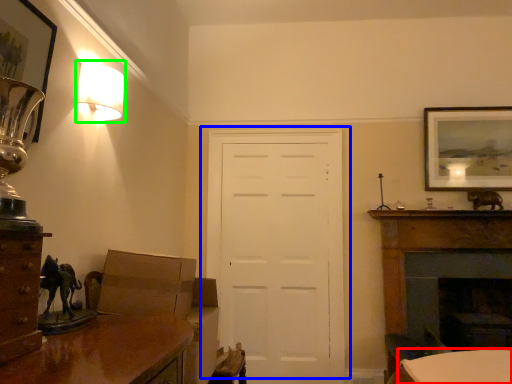
Question: Based on their relative distances, which object is nearer to table (highlighted by a red box)? Choose from door (highlighted by a blue box) and lamp (highlighted by a green box).

Choices:
 (A) door
 (B) lamp

Answer: (A)